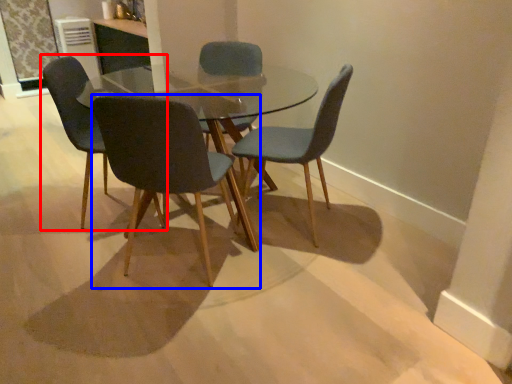
Question: Which object appears closest to the camera in this image, chair (highlighted by a red box) or chair (highlighted by a blue box)?

Choices:
 (A) chair
 (B) chair

Answer: (B)